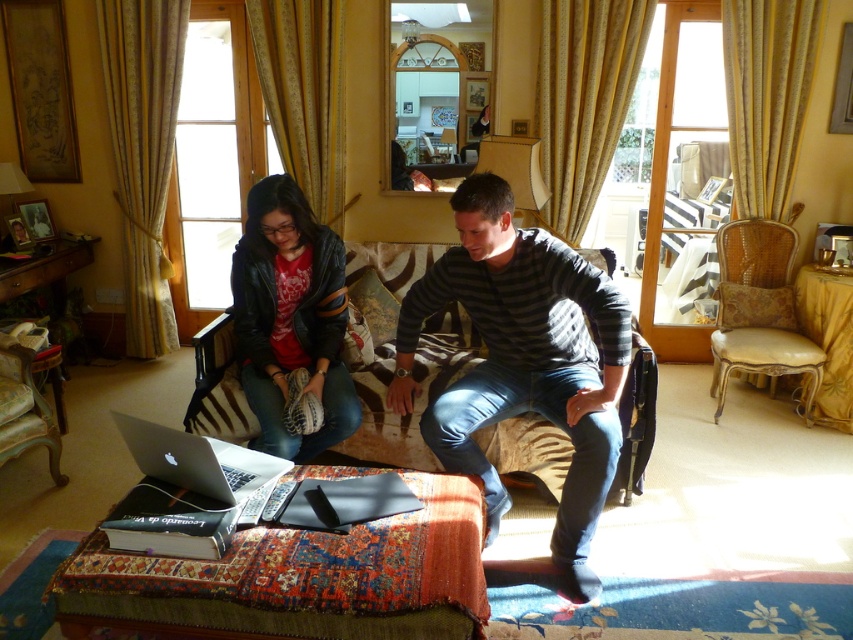
Question: Which object is the closest to the vintage upholstered armchair at lower left?

Choices:
 (A) zebra-patterned fabric couch at center
 (B) leather jacket at center
 (C) silver metallic laptop at center

Answer: (B)

Question: Where is light brown leather armchair at right located in relation to vintage upholstered armchair at lower left in the image?

Choices:
 (A) left
 (B) right

Answer: (B)

Question: Is dark gray striped sweater at center bigger than light brown leather armchair at right?

Choices:
 (A) yes
 (B) no

Answer: (A)

Question: Considering the real-world distances, which object is farthest from the zebra-patterned fabric couch at center?

Choices:
 (A) silver metallic laptop at center
 (B) dark gray striped sweater at center

Answer: (A)

Question: Which point is closer to the camera taking this photo?

Choices:
 (A) (32, 406)
 (B) (770, 285)
 (C) (567, 576)

Answer: (C)

Question: Does leather jacket at center have a greater width compared to silver metallic laptop at center?

Choices:
 (A) no
 (B) yes

Answer: (B)